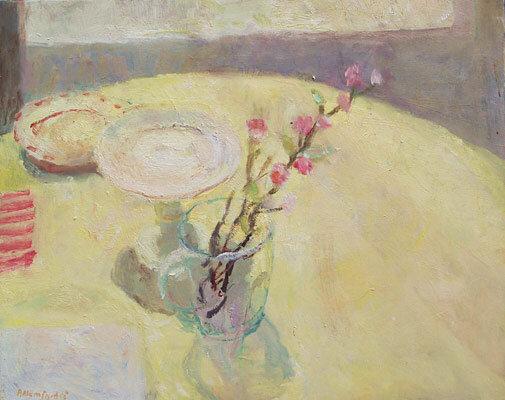
Locate an element on the screen. Image resolution: width=505 pixels, height=400 pixels. cup handle is located at coordinates (171, 261), (171, 307).